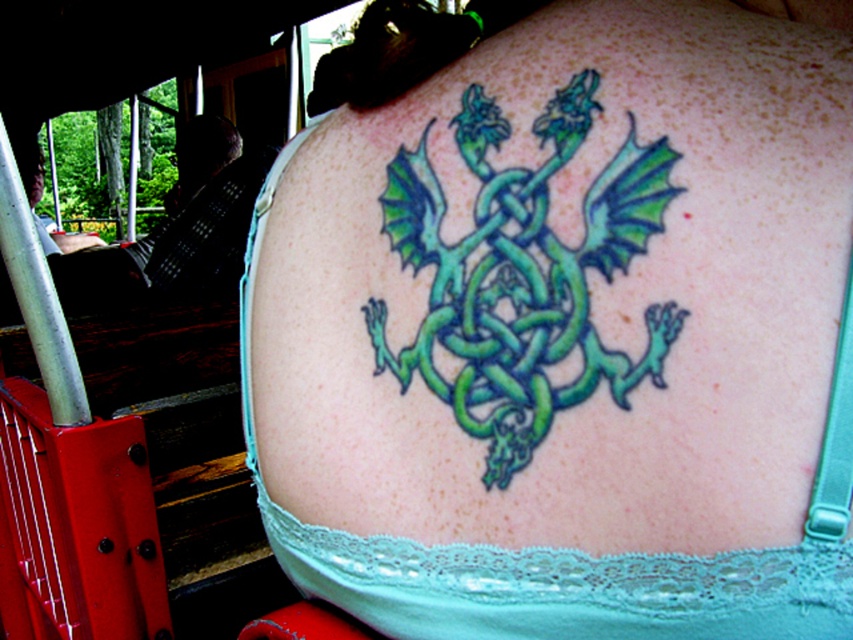
You are a tattoo artist examining the image of a person with two dragon designs. You need to determine which dragon is closer to you. The dragons are labeled as the green tattooed dragon at center and the green glossy dragon at center. Which one is nearer?

The green tattooed dragon at center is closer to the viewer than the green glossy dragon at center.